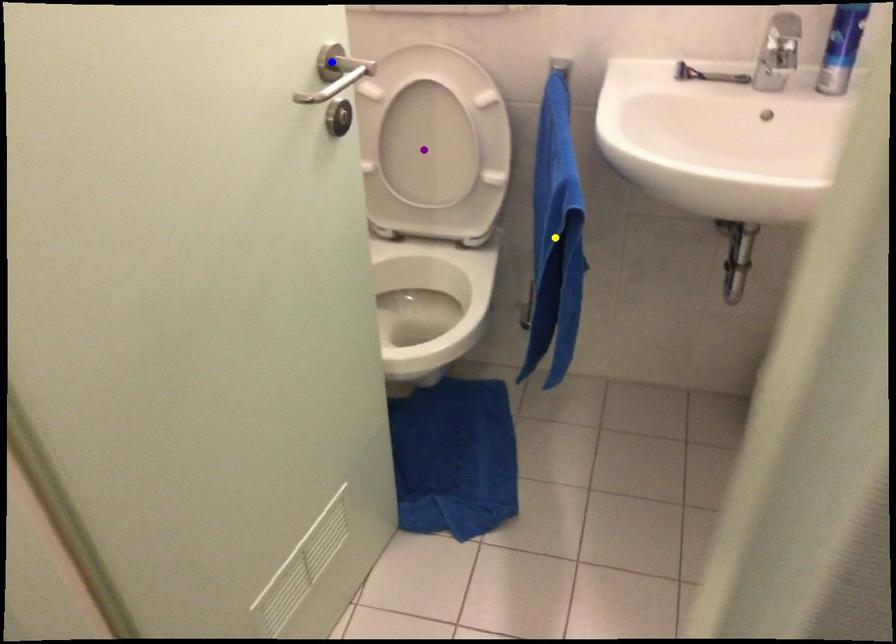
Order these from farthest to nearest:
- purple point
- blue point
- yellow point

purple point, yellow point, blue point